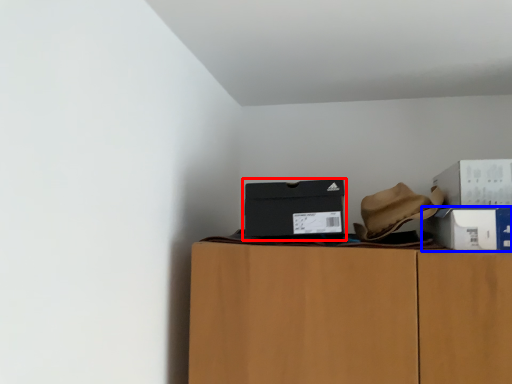
Question: Among these objects, which one is nearest to the camera, box (highlighted by a red box) or box (highlighted by a blue box)?

Choices:
 (A) box
 (B) box

Answer: (B)